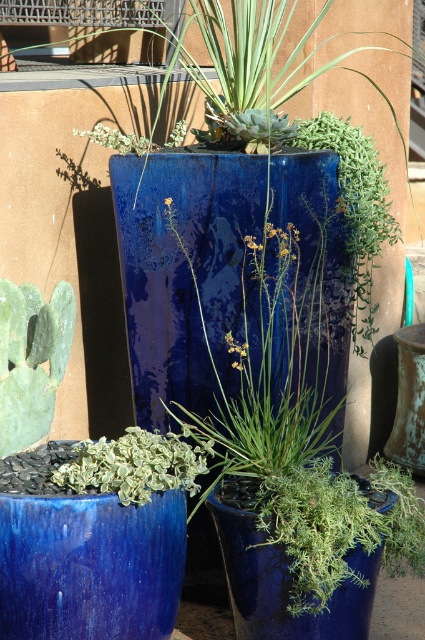
Can you confirm if green matte cactus at lower left is positioned to the right of green variegated leaf at center?

Incorrect, green matte cactus at lower left is not on the right side of green variegated leaf at center.

Based on the photo, who is more distant from viewer, [23,380] or [70,461]?

The point [23,380] is behind.

Where is `green matte cactus at lower left`? The height and width of the screenshot is (640, 425). green matte cactus at lower left is located at coordinates (31, 358).